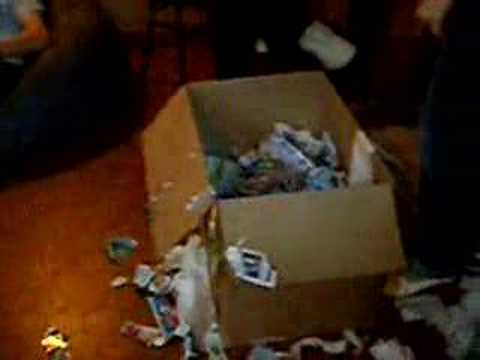
Image resolution: width=480 pixels, height=360 pixels. Find the location of `looks like a stool`. looks like a stool is located at coordinates (152, 41).